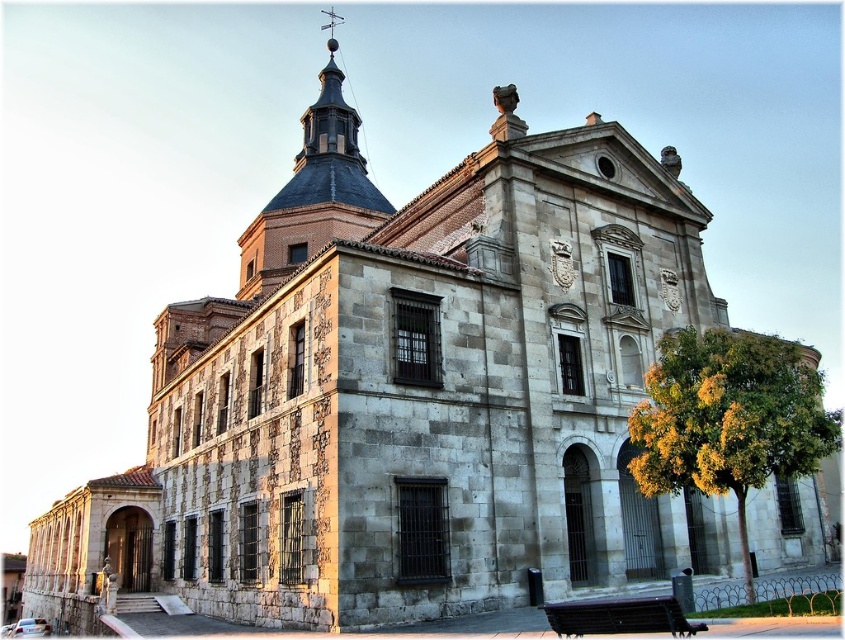
You are a tourist standing in front of the grand historic building. You want to take a photo that includes both the smooth stone spire at upper center and the wooden bench at lower center. Which object will appear larger in the photo?

The smooth stone spire at upper center is taller than the wooden bench at lower center, so it will appear larger in the photo.

You are an architect visiting this historic building and want to compare the sizes of the two notable features. Which object is larger between the smooth stone spire at upper center and the wooden bench at lower center?

The smooth stone spire at upper center is bigger than the wooden bench at lower center according to the description.